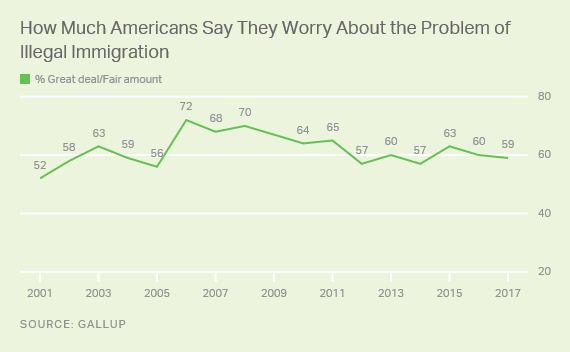
Find the location of a particular element. box is located at coordinates (23, 80).